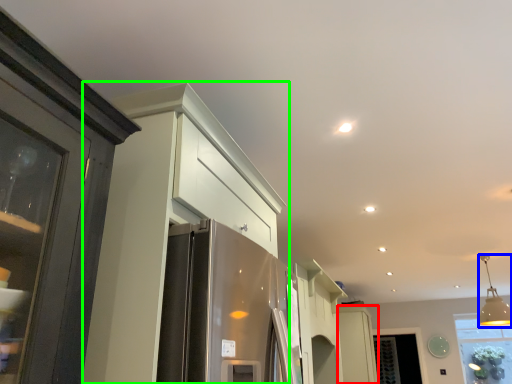
Question: Which is farther away from cabinetry (highlighted by a red box)? light fixture (highlighted by a blue box) or cabinetry (highlighted by a green box)?

Choices:
 (A) light fixture
 (B) cabinetry

Answer: (B)